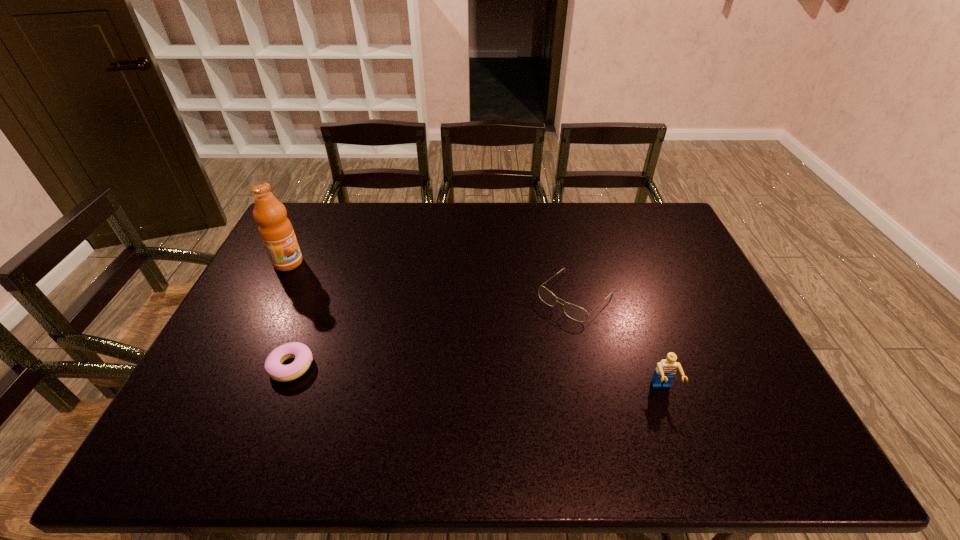
Find the location of a particular element. The image size is (960, 540). the shortest object is located at coordinates (273, 365).

Where is `the second object from left to right`? The image size is (960, 540). the second object from left to right is located at coordinates (273, 365).

Find the location of a particular element. Lego is located at coordinates (665, 371).

Locate an element on the screen. the second tallest object is located at coordinates (665, 371).

What are the coordinates of `spectacles` in the screenshot? It's located at (574, 312).

The image size is (960, 540). In order to click on the second shortest object in this screenshot , I will do `click(574, 312)`.

The height and width of the screenshot is (540, 960). Find the location of `the leftmost object`. the leftmost object is located at coordinates (276, 231).

The image size is (960, 540). I want to click on fruit juice, so click(276, 231).

At what (x,y) coordinates should I click in order to perform the action: click on vacant region located on the right of the doughnut. Please return your answer as a coordinate pair (x, y). The width and height of the screenshot is (960, 540). Looking at the image, I should click on (333, 366).

The width and height of the screenshot is (960, 540). I want to click on vacant region located on the front-facing side of the third tallest object, so click(514, 355).